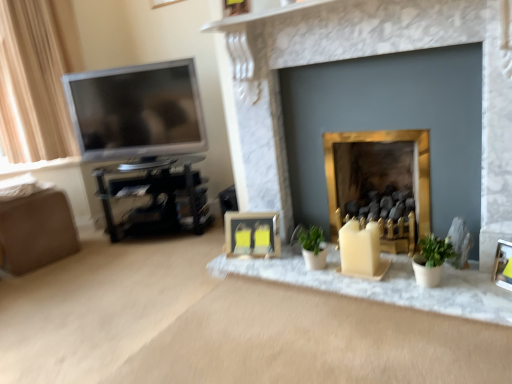
Measure the distance between point [167,109] and camera.

Point [167,109] and camera are 2.73 meters apart.

In order to face metallic gold picture frame at lower right, which ranks as the 1th picture frame in right-to-left order, should I rotate leftwards or rightwards?

Rotate your view right by about 32.238°.

You are a GUI agent. You are given a task and a screenshot of the screen. Output one action in this format:
    pyautogui.click(x=<x>, y=<y>)
    Task: Click on the marble fireplace at center, the first fireplace from the left
    
    Given the screenshot: What is the action you would take?
    pyautogui.click(x=350, y=58)

How different are the orientations of marble fireplace at center, which is counted as the second fireplace, starting from the right, and gold metallic fireplace at center, arranged as the 1th fireplace when viewed from the right, in degrees?

0.284 degrees separate the facing orientations of marble fireplace at center, which is counted as the second fireplace, starting from the right, and gold metallic fireplace at center, arranged as the 1th fireplace when viewed from the right.

Does marble fireplace at center, the first fireplace from the left, appear on the right side of gold metallic fireplace at center, the 2th fireplace positioned from the left?

Incorrect, marble fireplace at center, the first fireplace from the left, is not on the right side of gold metallic fireplace at center, the 2th fireplace positioned from the left.

Is marble fireplace at center, which is counted as the second fireplace, starting from the right, wider or thinner than gold metallic fireplace at center, arranged as the 1th fireplace when viewed from the right?

marble fireplace at center, which is counted as the second fireplace, starting from the right, is thinner than gold metallic fireplace at center, arranged as the 1th fireplace when viewed from the right.

From the image's perspective, is marble fireplace at center, which is counted as the second fireplace, starting from the right, above or below gold metallic fireplace at center, the 2th fireplace positioned from the left?

marble fireplace at center, which is counted as the second fireplace, starting from the right, is above gold metallic fireplace at center, the 2th fireplace positioned from the left.

From the image's perspective, who appears lower, gold metallic fireplace at center, the 2th fireplace positioned from the left, or satin silver television at left?

From the image's view, gold metallic fireplace at center, the 2th fireplace positioned from the left, is below.

Considering their positions, is gold metallic fireplace at center, arranged as the 1th fireplace when viewed from the right, located in front of or behind satin silver television at left?

Visually, gold metallic fireplace at center, arranged as the 1th fireplace when viewed from the right, is located in front of satin silver television at left.

You are a GUI agent. You are given a task and a screenshot of the screen. Output one action in this format:
    pyautogui.click(x=<x>, y=<y>)
    Task: Click on the entertainment center that appears below the satin silver television at left (from a real-world perspective)
    
    Given the screenshot: What is the action you would take?
    pyautogui.click(x=155, y=196)

Is satin silver television at left at the back of black plastic entertainment center at left?

No, black plastic entertainment center at left is not facing away from satin silver television at left.

From a real-world perspective, which is physically below, black plastic entertainment center at left or satin silver television at left?

black plastic entertainment center at left, from a real-world perspective.

Measure the distance between black plastic entertainment center at left and satin silver television at left.

black plastic entertainment center at left and satin silver television at left are 12.40 inches apart.

Which is further, (266, 241) or (103, 77)?

The point (103, 77) is farther.

Is satin silver television at left at the back of matte yellow candle at center, placed as the first candle when sorted from left to right?

No, matte yellow candle at center, placed as the first candle when sorted from left to right,'s orientation is not away from satin silver television at left.

Is matte yellow candle at center, which is the first candle in back-to-front order, not close to satin silver television at left?

That's right, there is a large distance between matte yellow candle at center, which is the first candle in back-to-front order, and satin silver television at left.

Is matte yellow candle at center, which is the first candle in back-to-front order, taller than satin silver television at left?

No, matte yellow candle at center, which is the first candle in back-to-front order, is not taller than satin silver television at left.

From a real-world perspective, is gold metallic fireplace at center, arranged as the 1th fireplace when viewed from the right, below matte yellow candle at center, which is the 2th candle in right-to-left order?

No, from a real-world perspective, gold metallic fireplace at center, arranged as the 1th fireplace when viewed from the right, is not under matte yellow candle at center, which is the 2th candle in right-to-left order.

Relative to matte yellow candle at center, which is the 2th candle in right-to-left order, is gold metallic fireplace at center, arranged as the 1th fireplace when viewed from the right, in front or behind?

In the image, gold metallic fireplace at center, arranged as the 1th fireplace when viewed from the right, appears in front of matte yellow candle at center, which is the 2th candle in right-to-left order.

Which object is wider, gold metallic fireplace at center, the 2th fireplace positioned from the left, or matte yellow candle at center, which is the 2th candle in right-to-left order?

gold metallic fireplace at center, the 2th fireplace positioned from the left, is wider.

Does gold metallic fireplace at center, arranged as the 1th fireplace when viewed from the right, turn towards matte yellow candle at center, which is the 2th candle in front-to-back order?

No.

Between gold metallic fireplace at center, arranged as the 1th fireplace when viewed from the right, and marble fireplace at center, the first fireplace from the left, which one appears on the left side from the viewer's perspective?

marble fireplace at center, the first fireplace from the left, is more to the left.

In the scene shown: From a real-world perspective, is gold metallic fireplace at center, the 2th fireplace positioned from the left, located beneath marble fireplace at center, which is counted as the second fireplace, starting from the right?

Correct, in the physical world, gold metallic fireplace at center, the 2th fireplace positioned from the left, is lower than marble fireplace at center, which is counted as the second fireplace, starting from the right.

From the picture: In terms of size, does gold metallic fireplace at center, the 2th fireplace positioned from the left, appear bigger or smaller than marble fireplace at center, which is counted as the second fireplace, starting from the right?

gold metallic fireplace at center, the 2th fireplace positioned from the left, is smaller than marble fireplace at center, which is counted as the second fireplace, starting from the right.

Is black plastic entertainment center at left positioned far away from matte yellow candle at center, placed as the first candle when sorted from left to right?

Actually, black plastic entertainment center at left and matte yellow candle at center, placed as the first candle when sorted from left to right, are a little close together.

Identify the location of entertainment center located behind the matte yellow candle at center, placed as the first candle when sorted from left to right. [x=155, y=196].

From a real-world perspective, which object stands above the other?

black plastic entertainment center at left.

Which object is wider, black plastic entertainment center at left or matte yellow candle at center, which is the first candle in back-to-front order?

Wider between the two is black plastic entertainment center at left.

I want to click on fireplace located underneath the marble fireplace at center, the first fireplace from the left (from a real-world perspective), so click(379, 178).

Starting from the satin silver television at left, which fireplace is the 1st one in front? Please provide its 2D coordinates.

[(379, 178)]

Looking at the image, which one is located closer to metallic gold picture frame at lower right, which is counted as the second picture frame, starting from the left, satin silver television at left or matte black picture frame at center, which is the 2th picture frame from right to left?

matte black picture frame at center, which is the 2th picture frame from right to left, lies closer to metallic gold picture frame at lower right, which is counted as the second picture frame, starting from the left, than the other object.

Estimate the real-world distances between objects in this image. Which object is further from marble fireplace at center, the first fireplace from the left, satin silver television at left or matte yellow candle at center, which is the 2th candle in right-to-left order?

satin silver television at left is further to marble fireplace at center, the first fireplace from the left.

When comparing their distances from metallic gold picture frame at lower right, arranged as the 2th picture frame when viewed from the back, does black plastic entertainment center at left or beige matte candle at center, which ranks as the 2th candle in back-to-front order, seem closer?

beige matte candle at center, which ranks as the 2th candle in back-to-front order, is positioned closer to the anchor metallic gold picture frame at lower right, arranged as the 2th picture frame when viewed from the back.

Estimate the real-world distances between objects in this image. Which object is closer to metallic gold picture frame at lower right, which is counted as the second picture frame, starting from the left, marble fireplace at center, the first fireplace from the left, or satin silver television at left?

marble fireplace at center, the first fireplace from the left, is closer to metallic gold picture frame at lower right, which is counted as the second picture frame, starting from the left.

Estimate the real-world distances between objects in this image. Which object is further from beige matte candle at center, arranged as the 2th candle when viewed from the left, matte yellow candle at center, placed as the first candle when sorted from left to right, or satin silver television at left?

Based on the image, satin silver television at left appears to be further to beige matte candle at center, arranged as the 2th candle when viewed from the left.

Consider the image. When comparing their distances from beige matte candle at center, the 1th candle in the front-to-back sequence, does black plastic entertainment center at left or gold metallic fireplace at center, the 2th fireplace positioned from the left, seem closer?

gold metallic fireplace at center, the 2th fireplace positioned from the left, lies closer to beige matte candle at center, the 1th candle in the front-to-back sequence, than the other object.

Looking at the image, which one is located closer to matte yellow candle at center, placed as the first candle when sorted from left to right, black plastic entertainment center at left or metallic gold picture frame at lower right, which is counted as the second picture frame, starting from the left?

Among the two, black plastic entertainment center at left is located nearer to matte yellow candle at center, placed as the first candle when sorted from left to right.

From the image, which object appears to be farther from matte yellow candle at center, placed as the first candle when sorted from left to right, satin silver television at left or black plastic entertainment center at left?

satin silver television at left is further to matte yellow candle at center, placed as the first candle when sorted from left to right.

Where is `candle between marble fireplace at center, the first fireplace from the left, and metallic gold picture frame at lower right, placed as the first picture frame when sorted from front to back, in the horizontal direction`? The image size is (512, 384). candle between marble fireplace at center, the first fireplace from the left, and metallic gold picture frame at lower right, placed as the first picture frame when sorted from front to back, in the horizontal direction is located at coordinates (359, 249).

Find the location of `picture frame between satin silver television at left and marble fireplace at center, the first fireplace from the left`. picture frame between satin silver television at left and marble fireplace at center, the first fireplace from the left is located at coordinates (252, 234).

At what (x,y) coordinates should I click in order to perform the action: click on fireplace located between black plastic entertainment center at left and gold metallic fireplace at center, the 2th fireplace positioned from the left, in the left-right direction. Please return your answer as a coordinate pair (x, y). This screenshot has width=512, height=384. Looking at the image, I should click on (350, 58).

This screenshot has height=384, width=512. Identify the location of candle located between matte black picture frame at center, acting as the 1th picture frame starting from the left, and beige matte candle at center, the 1th candle in the front-to-back sequence, in the left-right direction. (262, 239).